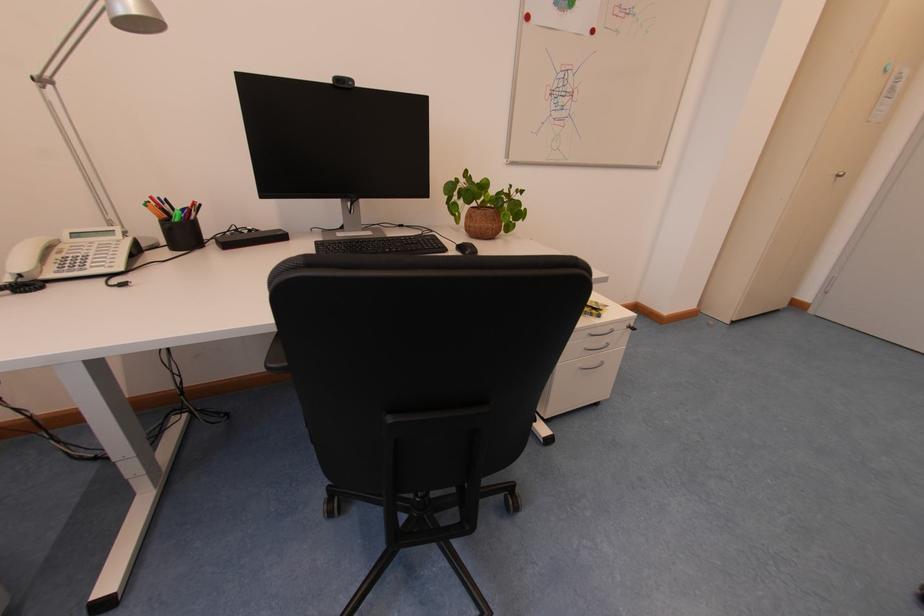
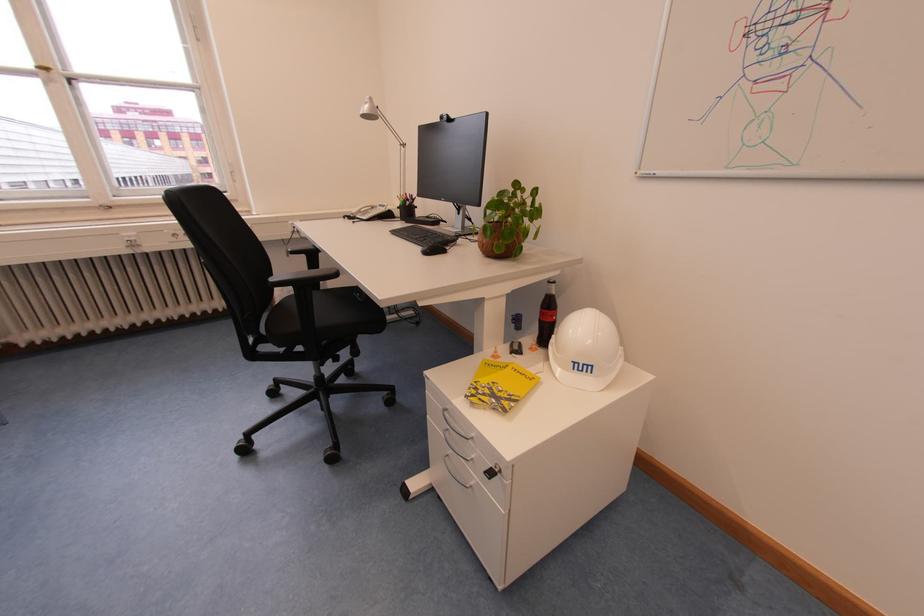
Locate, in the second image, the point that corresponds to point 473,176 in the first image.

(524, 187)